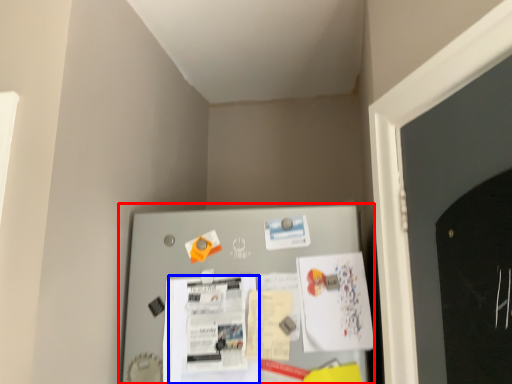
Question: Which of the following is the closest to the observer, bulletin board (highlighted by a red box) or poster (highlighted by a blue box)?

Choices:
 (A) bulletin board
 (B) poster

Answer: (A)